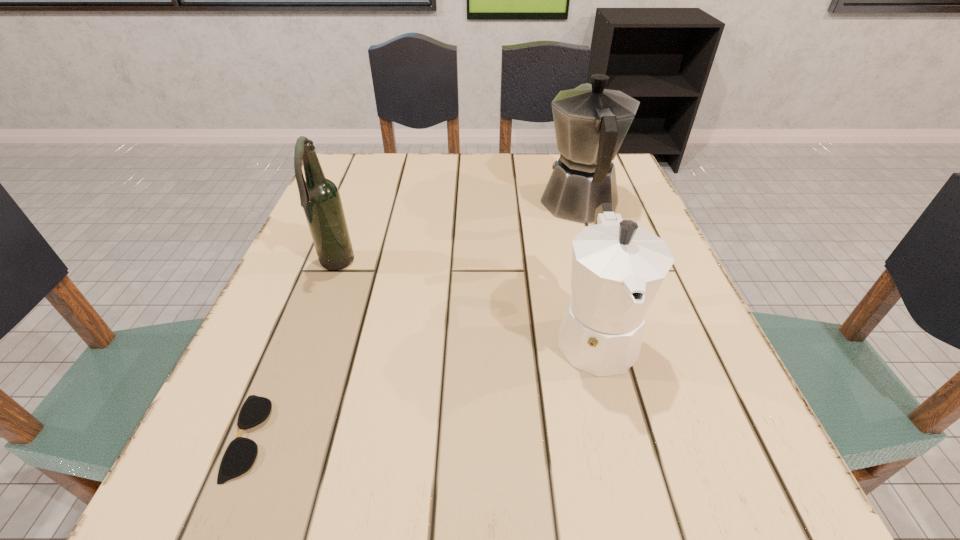
You are a GUI agent. You are given a task and a screenshot of the screen. Output one action in this format:
    pyautogui.click(x=<x>, y=<y>)
    Task: Click on the vacant space that is in between the second nearest object and the second farthest object
    The height and width of the screenshot is (540, 960).
    Given the screenshot: What is the action you would take?
    point(466,300)

The height and width of the screenshot is (540, 960). What are the coordinates of `free space between the shorter coffeepot and the spectacles` in the screenshot? It's located at (421, 386).

Find the location of a particular element. This screenshot has width=960, height=540. unoccupied position between the shorter coffeepot and the second farthest object is located at coordinates (466, 300).

Select which object is the closest to the shorter coffeepot. Please provide its 2D coordinates. Your answer should be formatted as a tuple, i.e. [(x, y)], where the tuple contains the x and y coordinates of a point satisfying the conditions above.

[(591, 122)]

Locate which object is the closest to the beer bottle. Please provide its 2D coordinates. Your answer should be formatted as a tuple, i.e. [(x, y)], where the tuple contains the x and y coordinates of a point satisfying the conditions above.

[(240, 455)]

Image resolution: width=960 pixels, height=540 pixels. Find the location of `vacant space that satisfies the following two spatial constraints: 1. on the back side of the shortest object; 2. on the right side of the third nearest object`. vacant space that satisfies the following two spatial constraints: 1. on the back side of the shortest object; 2. on the right side of the third nearest object is located at coordinates (320, 265).